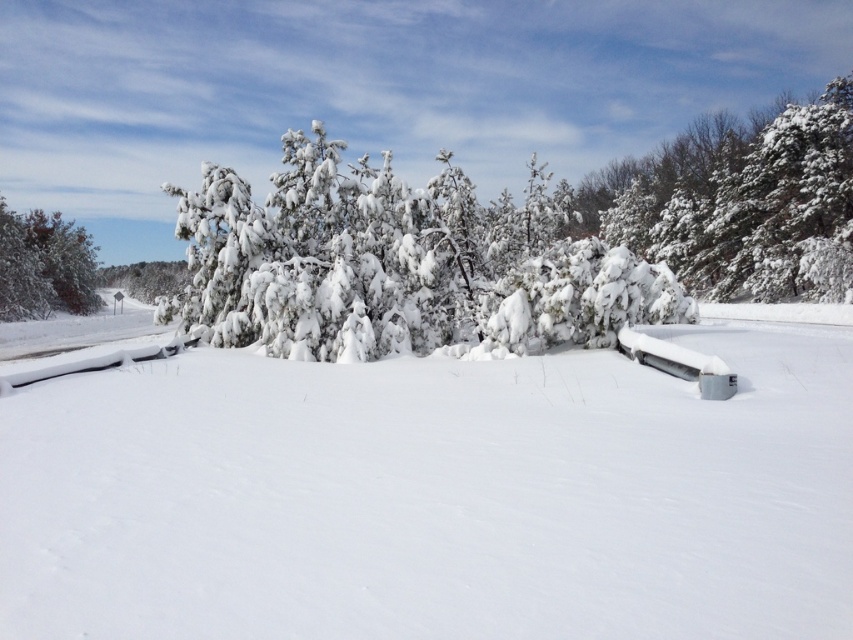
Does white fluffy snow at center appear on the left side of white fluffy snow-covered trees at center?

Correct, you'll find white fluffy snow at center to the left of white fluffy snow-covered trees at center.

What do you see at coordinates (434, 497) in the screenshot? I see `white fluffy snow at center` at bounding box center [434, 497].

Where is `white fluffy snow at center`? white fluffy snow at center is located at coordinates (434, 497).

Consider the image. Is the position of white fluffy snow at center more distant than that of green matte tree at left?

No, it is in front of green matte tree at left.

Between point (329, 612) and point (74, 292), which one is positioned in front?

Point (329, 612) is more forward.

Is point (521, 589) farther from camera compared to point (28, 291)?

That is False.

Image resolution: width=853 pixels, height=640 pixels. Find the location of `white fluffy snow at center`. white fluffy snow at center is located at coordinates (434, 497).

How distant is white fluffy snow-covered trees at center from white plastic bench at center?

A distance of 11.17 meters exists between white fluffy snow-covered trees at center and white plastic bench at center.

Does point (485, 321) lie behind point (729, 376)?

Yes, point (485, 321) is farther from viewer.

Which is behind, point (582, 266) or point (703, 365)?

Point (582, 266)

Find the location of a particular element. The width and height of the screenshot is (853, 640). white fluffy snow-covered trees at center is located at coordinates (399, 262).